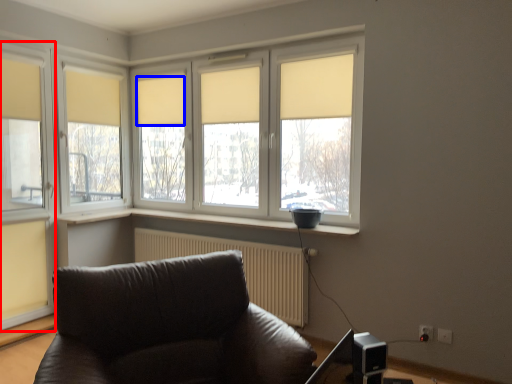
Question: Which object is closer to the camera taking this photo, window (highlighted by a red box) or curtain (highlighted by a blue box)?

Choices:
 (A) window
 (B) curtain

Answer: (A)